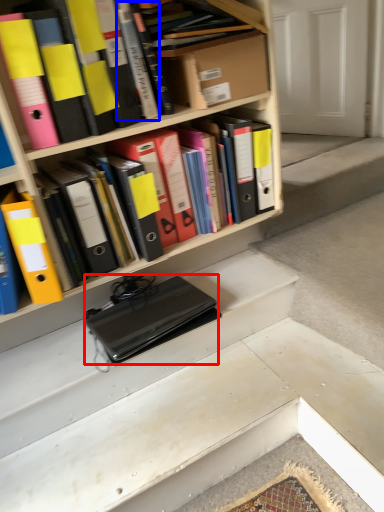
Question: Which object appears closest to the camera in this image, laptop (highlighted by a red box) or book (highlighted by a blue box)?

Choices:
 (A) laptop
 (B) book

Answer: (B)